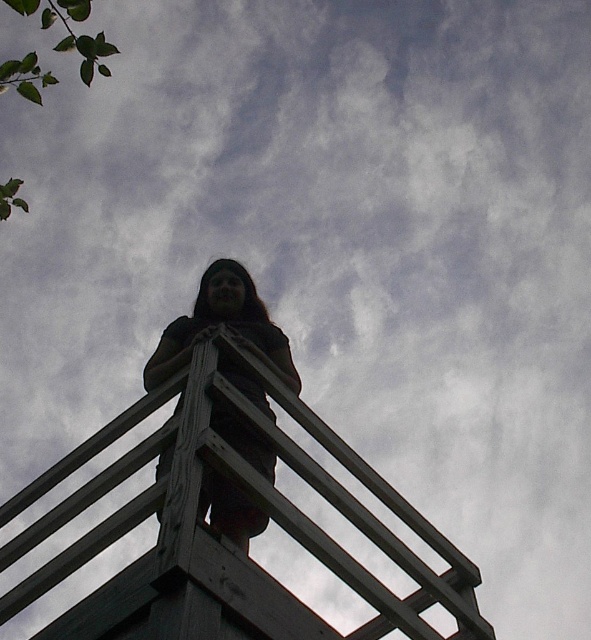
Question: Which of the following is the farthest from the observer?

Choices:
 (A) dark brown leather jacket at center
 (B) wooden rail at center

Answer: (A)

Question: Which point is closer to the camera taking this photo?

Choices:
 (A) pyautogui.click(x=164, y=371)
 (B) pyautogui.click(x=460, y=598)

Answer: (B)

Question: Is wooden rail at center above dark brown leather jacket at center?

Choices:
 (A) yes
 (B) no

Answer: (B)

Question: In this image, where is wooden rail at center located relative to dark brown leather jacket at center?

Choices:
 (A) right
 (B) left

Answer: (A)

Question: Does wooden rail at center have a greater width compared to dark brown leather jacket at center?

Choices:
 (A) no
 (B) yes

Answer: (B)